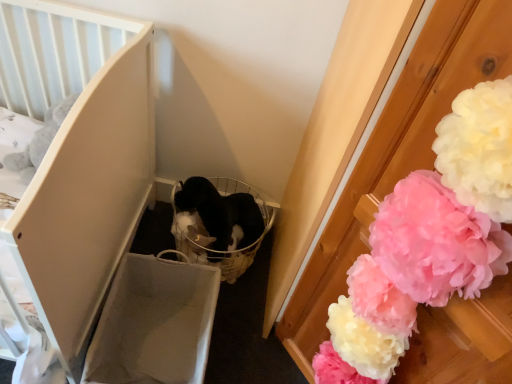
Question: Do you think matte white crib at left is within white fluffy pom-pom at right, or outside of it?

Choices:
 (A) outside
 (B) inside

Answer: (A)

Question: In terms of height, does matte white crib at left look taller or shorter compared to white fluffy pom-pom at right?

Choices:
 (A) short
 (B) tall

Answer: (A)

Question: Is matte white crib at left bigger or smaller than white fluffy pom-pom at right?

Choices:
 (A) big
 (B) small

Answer: (A)

Question: Does point (492, 155) appear closer or farther from the camera than point (144, 124)?

Choices:
 (A) farther
 (B) closer

Answer: (B)

Question: Based on their positions, is white fluffy pom-pom at right located to the left or right of matte white crib at left?

Choices:
 (A) left
 (B) right

Answer: (B)

Question: From the image's perspective, is white fluffy pom-pom at right positioned above or below matte white crib at left?

Choices:
 (A) above
 (B) below

Answer: (B)

Question: Looking at the image, does white fluffy pom-pom at right seem bigger or smaller compared to matte white crib at left?

Choices:
 (A) big
 (B) small

Answer: (B)